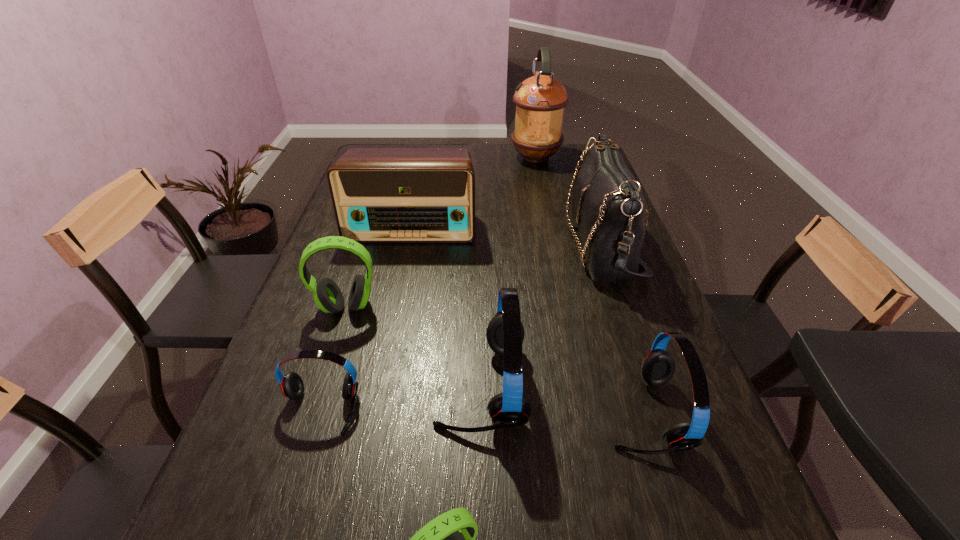
Where is `vacant position located with the microphone attached to the side of the rightmost headset`? The image size is (960, 540). vacant position located with the microphone attached to the side of the rightmost headset is located at coordinates (544, 413).

Identify the location of vacant space located with the microphone attached to the side of the rightmost headset. The height and width of the screenshot is (540, 960). (519, 413).

At what (x,y) coordinates should I click in order to perform the action: click on free spot located 0.150m with the microphone attached to the side of the leftmost red headset. Please return your answer as a coordinate pair (x, y). Looking at the image, I should click on (287, 520).

Locate an element on the screen. Image resolution: width=960 pixels, height=540 pixels. object situated at the far edge is located at coordinates (540, 100).

Identify the location of radio receiver at the left edge. The image size is (960, 540). (380, 195).

This screenshot has width=960, height=540. Identify the location of oil lamp that is at the right edge. (540, 100).

Identify the location of handbag at the right edge. (608, 207).

You are a GUI agent. You are given a task and a screenshot of the screen. Output one action in this format:
    pyautogui.click(x=<x>, y=<y>)
    Task: Click on the headset situated at the right edge
    The width and height of the screenshot is (960, 540).
    Given the screenshot: What is the action you would take?
    point(658,367)

This screenshot has width=960, height=540. I want to click on object situated at the far right corner, so click(x=540, y=100).

Find the location of `free space at the far edge of the desktop`. free space at the far edge of the desktop is located at coordinates (504, 170).